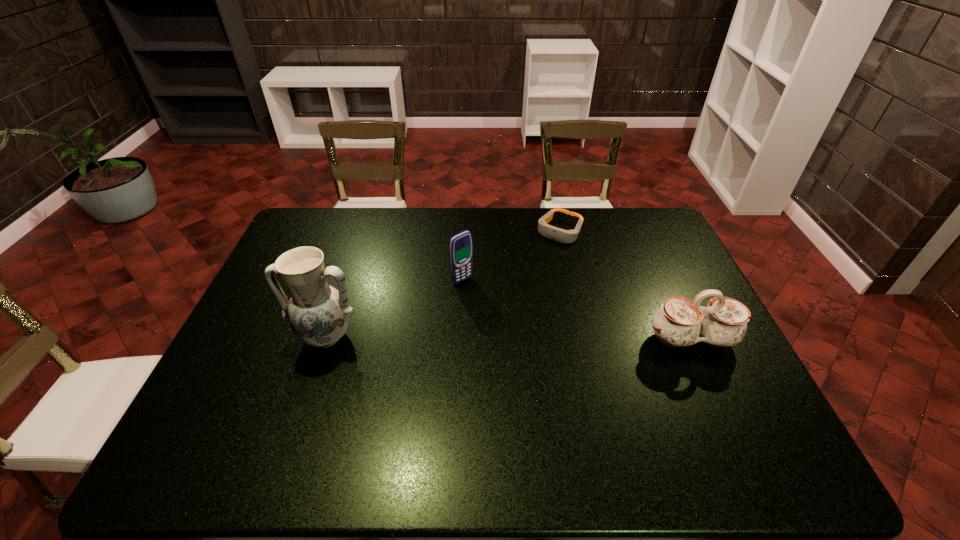
You are a GUI agent. You are given a task and a screenshot of the screen. Output one action in this format:
    pyautogui.click(x=<x>, y=<y>)
    Task: Click on the free space on the desktop that is between the leftmost object and the chinaware and is positioned on the front and back of the goggles
    
    Given the screenshot: What is the action you would take?
    pyautogui.click(x=478, y=338)

At what (x,y) coordinates should I click in order to perform the action: click on vacant space on the desktop that is between the tallest object and the rightmost object and is positioned on the front-facing side of the second object from left to right. Please return your answer as a coordinate pair (x, y). Looking at the image, I should click on (530, 338).